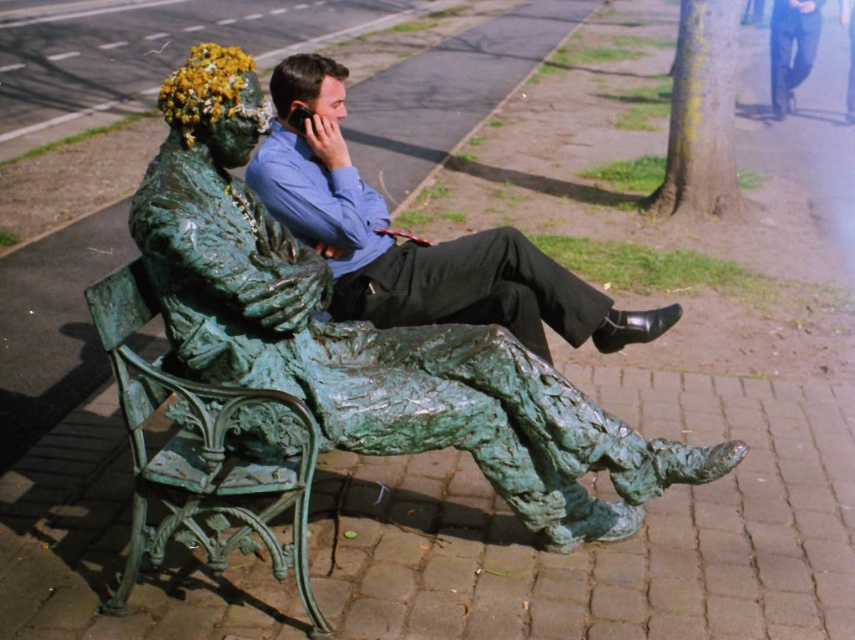
Consider the image. You are a visitor at a park and see both the green patinated bronze statue at center and the matte green statue at center. Which one is positioned lower in the image?

The green patinated bronze statue at center is positioned lower than the matte green statue at center.

You are a visitor at a park and see both the green patinated bronze statue at center and the matte green statue at center. Which statue is located to the left of the other?

The green patinated bronze statue at center is positioned on the left side of the matte green statue at center.

Looking at this image, you are standing at the point with coordinates point (332, 228) and want to walk to the point with coordinates point (175, 348). According to the scene description, which direction should you move to reach your destination?

To reach point (175, 348) from point (332, 228), you should move forward since point (175, 348) is in front of point (332, 228).